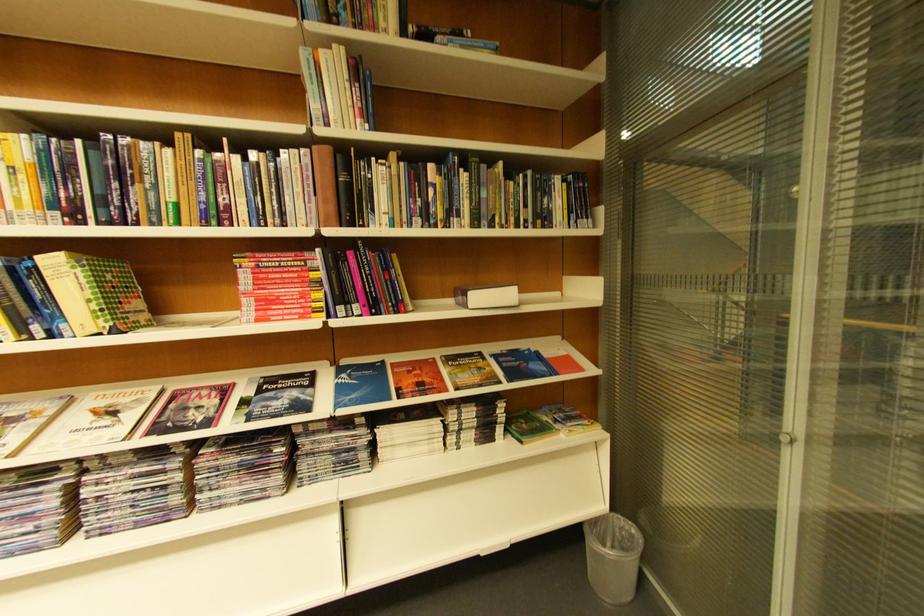
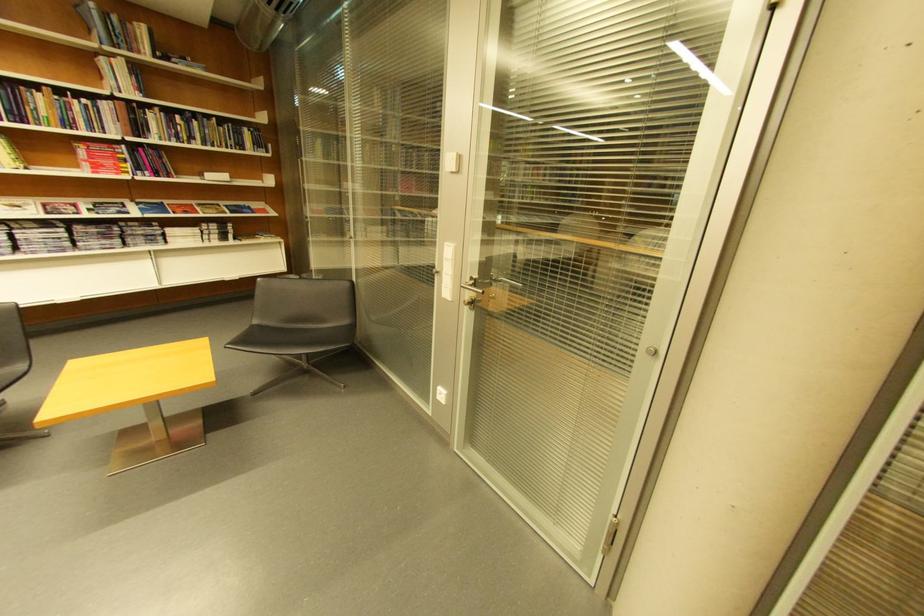
Where in the second image is the point corresponding to the point at 178,198 from the first image?

(54, 116)